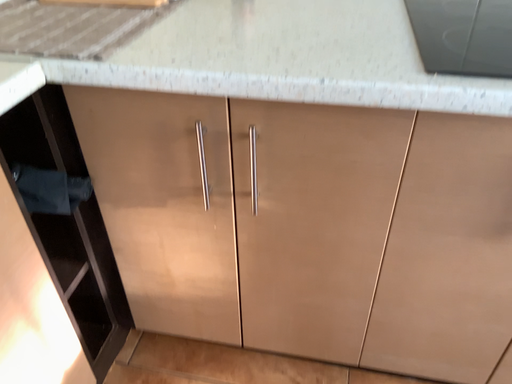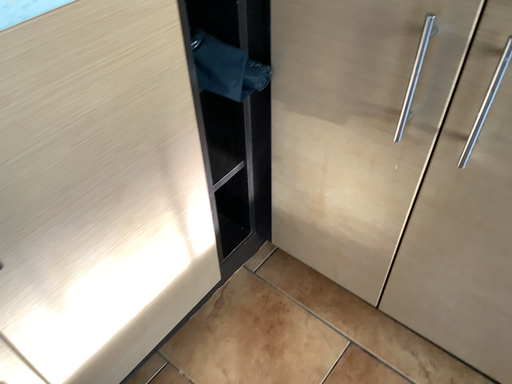
Question: How did the camera likely rotate when shooting the video?

Choices:
 (A) rotated right
 (B) rotated left

Answer: (B)